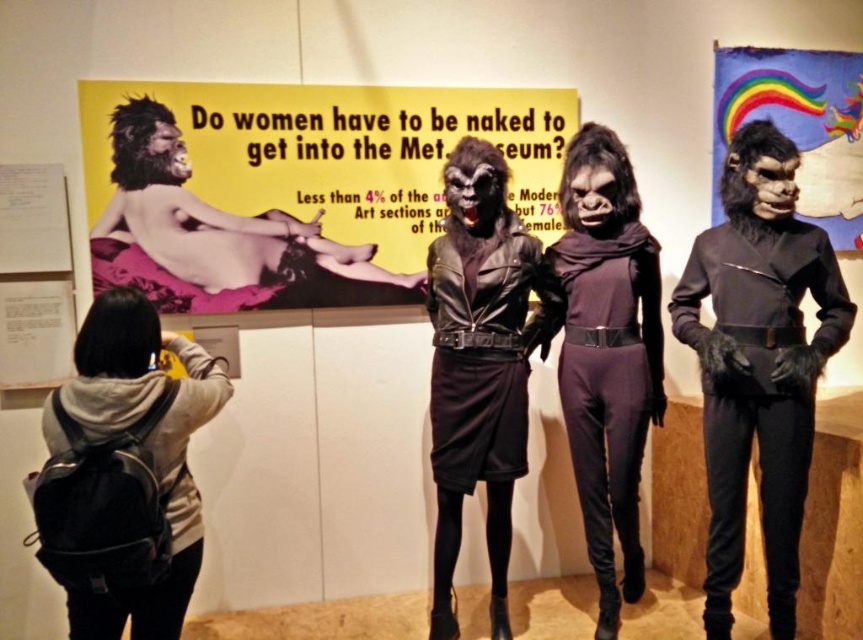
Question: Which point appears farthest from the camera in this image?

Choices:
 (A) (748, 272)
 (B) (606, 449)
 (C) (137, 410)
 (D) (433, 266)

Answer: (B)

Question: Does black leather dress at center appear on the left side of rainbow fabric poster at upper right?

Choices:
 (A) no
 (B) yes

Answer: (B)

Question: Is matte black suit at center closer to the viewer compared to matte black gorilla at center?

Choices:
 (A) yes
 (B) no

Answer: (A)

Question: Is matte black suit at center to the right of purple matte jumpsuit at center from the viewer's perspective?

Choices:
 (A) no
 (B) yes

Answer: (B)

Question: Which of the following is the closest to the observer?

Choices:
 (A) (193, 272)
 (B) (470, 468)
 (C) (111, 417)
 (D) (776, 618)

Answer: (C)

Question: Which point is farther to the camera?

Choices:
 (A) (753, 90)
 (B) (561, 314)

Answer: (A)